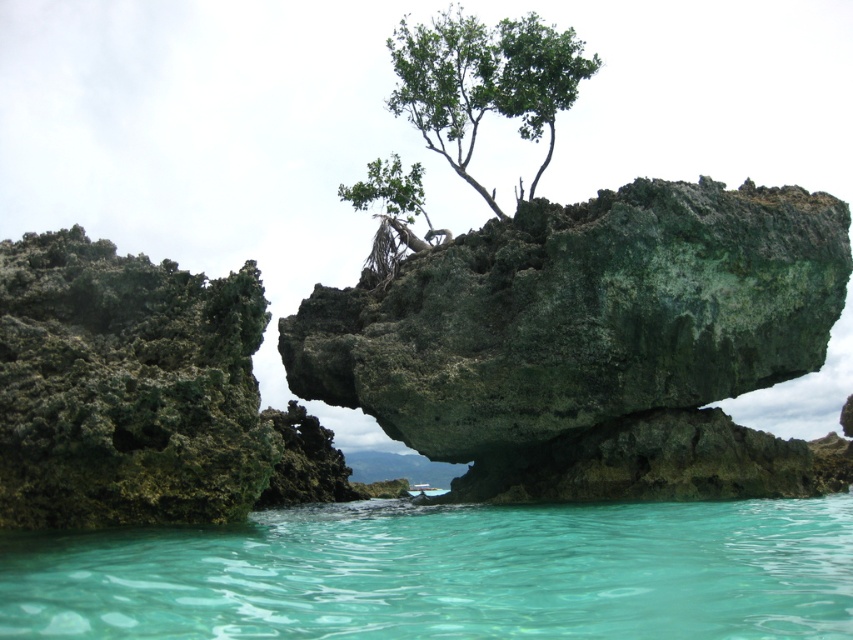
You are a hiker who wants to cross the clear water at lower center to reach the green mossy rock at center. The average walking speed of a person is 3 feet per second. How many seconds will it take you to cross the water to reach the rock?

The distance between the green mossy rock at center and the clear water at lower center is 14.46 feet. At a walking speed of 3 feet per second, it would take approximately 4.82 seconds to cross the water and reach the rock.

Based on the photo, you are a hiker who wants to cross the clear water at lower center. To your left, there is a green mossy rock at left. Which direction should you walk to reach the water from the rock?

You should walk to the right of the green mossy rock at left to reach the clear water at lower center because the water is located to the right of the rock according to the description.